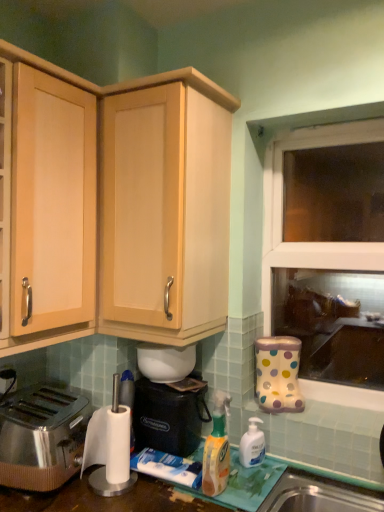
Question: Could you tell me if white glossy bowl at center, placed as the first appliance when sorted from top to bottom, is turned towards polished stainless steel toaster at lower left?

Choices:
 (A) yes
 (B) no

Answer: (B)

Question: Is white glossy bowl at center, the second appliance in the bottom-to-top sequence, taller than polished stainless steel toaster at lower left?

Choices:
 (A) yes
 (B) no

Answer: (B)

Question: From the image's perspective, is white glossy bowl at center, the second appliance in the bottom-to-top sequence, below polished stainless steel toaster at lower left?

Choices:
 (A) no
 (B) yes

Answer: (A)

Question: Does white glossy bowl at center, placed as the first appliance when sorted from top to bottom, have a smaller size compared to polished stainless steel toaster at lower left?

Choices:
 (A) no
 (B) yes

Answer: (B)

Question: Is white glossy bowl at center, placed as the first appliance when sorted from top to bottom, to the right of polished stainless steel toaster at lower left from the viewer's perspective?

Choices:
 (A) yes
 (B) no

Answer: (A)

Question: In terms of width, does light wood cabinet at upper center, which appears as the 2th cabinetry when viewed from the left, look wider or thinner when compared to white translucent pump bottle at lower center, the 1th bottle viewed from the back?

Choices:
 (A) wide
 (B) thin

Answer: (A)

Question: Looking at the image, does light wood cabinet at upper center, which appears as the 2th cabinetry when viewed from the left, seem bigger or smaller compared to white translucent pump bottle at lower center, the 2th bottle when ordered from front to back?

Choices:
 (A) small
 (B) big

Answer: (B)

Question: Would you say light wood cabinet at upper center, which appears as the 2th cabinetry when viewed from the left, is inside or outside white translucent pump bottle at lower center, which ranks as the first bottle in right-to-left order?

Choices:
 (A) outside
 (B) inside

Answer: (A)

Question: From the image's perspective, is light wood cabinet at upper center, which appears as the 2th cabinetry when viewed from the left, above or below white translucent pump bottle at lower center, the 1th bottle viewed from the back?

Choices:
 (A) below
 (B) above

Answer: (B)

Question: Considering the relative positions of light wood cabinet at left, acting as the 2th cabinetry starting from the right, and white translucent pump bottle at lower center, the 2th bottle when ordered from front to back, in the image provided, is light wood cabinet at left, acting as the 2th cabinetry starting from the right, to the left or to the right of white translucent pump bottle at lower center, the 2th bottle when ordered from front to back,?

Choices:
 (A) left
 (B) right

Answer: (A)

Question: From the image's perspective, relative to white translucent pump bottle at lower center, which ranks as the first bottle in right-to-left order, is light wood cabinet at left, acting as the 2th cabinetry starting from the right, above or below?

Choices:
 (A) below
 (B) above

Answer: (B)

Question: In terms of width, does light wood cabinet at left, acting as the 2th cabinetry starting from the right, look wider or thinner when compared to white translucent pump bottle at lower center, marked as the second bottle in a left-to-right arrangement?

Choices:
 (A) wide
 (B) thin

Answer: (A)

Question: Does point (59, 173) appear closer or farther from the camera than point (241, 437)?

Choices:
 (A) farther
 (B) closer

Answer: (B)

Question: From the image's perspective, relative to white glossy bowl at center, placed as the first appliance when sorted from top to bottom, is white translucent pump bottle at lower center, the 2th bottle when ordered from front to back, above or below?

Choices:
 (A) above
 (B) below

Answer: (B)

Question: Considering the positions of white translucent pump bottle at lower center, the 1th bottle viewed from the back, and white glossy bowl at center, placed as the first appliance when sorted from top to bottom, in the image, is white translucent pump bottle at lower center, the 1th bottle viewed from the back, bigger or smaller than white glossy bowl at center, placed as the first appliance when sorted from top to bottom,?

Choices:
 (A) big
 (B) small

Answer: (B)